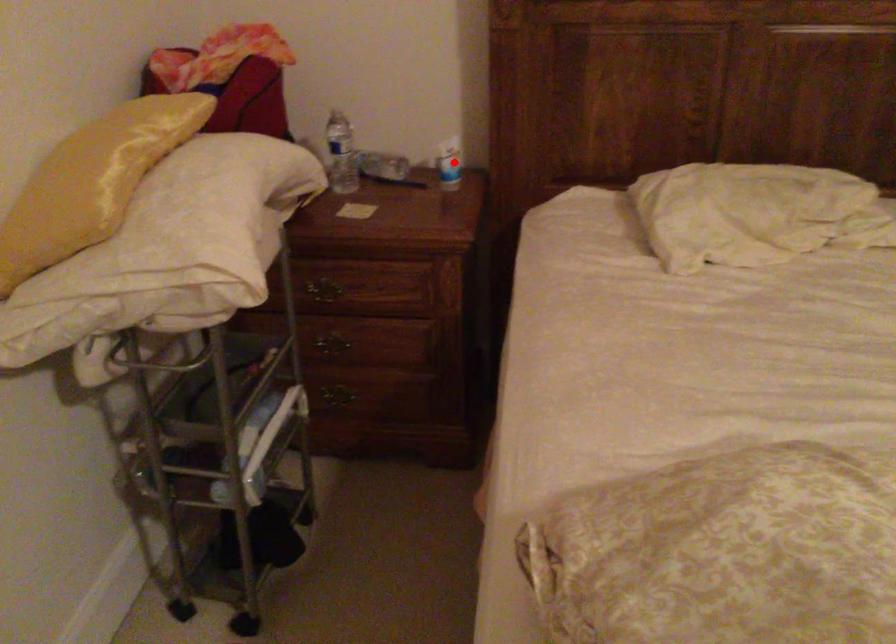
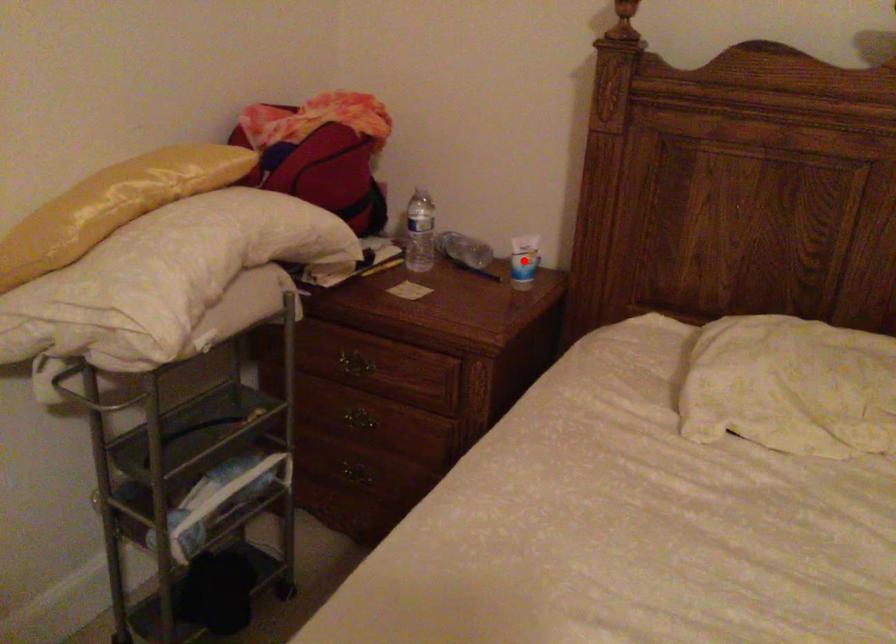
I am providing you with two images of the same scene from different viewpoints. A red point is marked on the first image and another point is marked on the second image. Is the red point in image1 aligned with the point shown in image2?

Yes